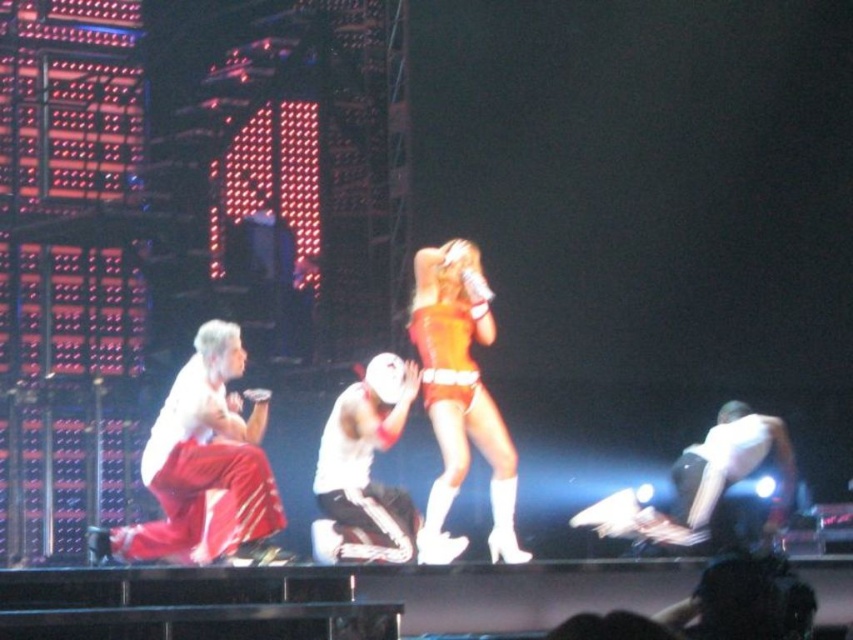
You are a photographer positioned at the camera. You want to capture a closeup shot of the shiny red pants at left. Given that your camera can focus on objects within 10 meters, will you be able to take the photo?

The shiny red pants at left is 40.68 meters away from camera, so the camera cannot focus on it since it is beyond the 10 meters range.

You are a stagehand responsible for adjusting the spotlight. The spotlight can only focus on objects within a 0.3 unit radius centered at point 0.5,0.5. Is the shiny red pants at left within this area?

The shiny red pants at left is located at point (206, 467). The distance from the center point (426, 320) to (206, 467) is sqrt of 0.23 squared plus 0.26 squared which is sqrt of 0.0529 plus 0.0676 equals sqrt of 0.1205 which is approximately 0.347 units. Since 0.347 is greater than 0.3, the shiny red pants at left is outside the spotlight area.

You are a photographer positioned at the front of the stage. You want to capture a photo that includes both the shiny orange bodysuit at center and the white matte jersey at center. Which performer should you focus on first to ensure both are in frame?

You should focus on the shiny orange bodysuit at center first because it is closer to you than the white matte jersey at center, ensuring both will be in frame when focused properly.